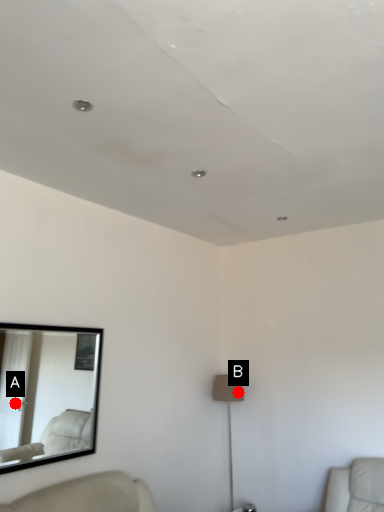
Question: Two points are circled on the image, labeled by A and B beside each circle. Which point appears closest to the camera in this image?

Choices:
 (A) A is closer
 (B) B is closer

Answer: (A)